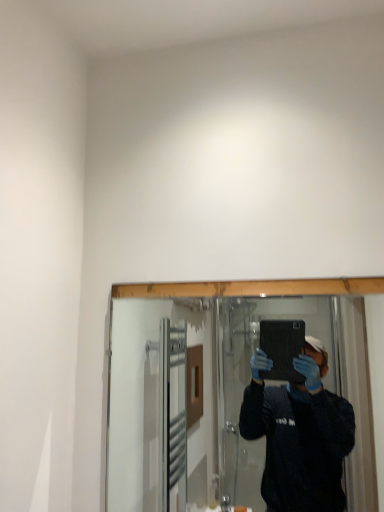
In order to face clear glass mirror at center, should I rotate leftwards or rightwards?

Turn right by 6.473 degrees to look at clear glass mirror at center.

You are a GUI agent. You are given a task and a screenshot of the screen. Output one action in this format:
    pyautogui.click(x=<x>, y=<y>)
    Task: Click on the clear glass mirror at center
    The image size is (384, 512).
    Given the screenshot: What is the action you would take?
    pyautogui.click(x=229, y=398)

What do you see at coordinates (229, 398) in the screenshot?
I see `clear glass mirror at center` at bounding box center [229, 398].

The height and width of the screenshot is (512, 384). Identify the location of clear glass mirror at center. (229, 398).